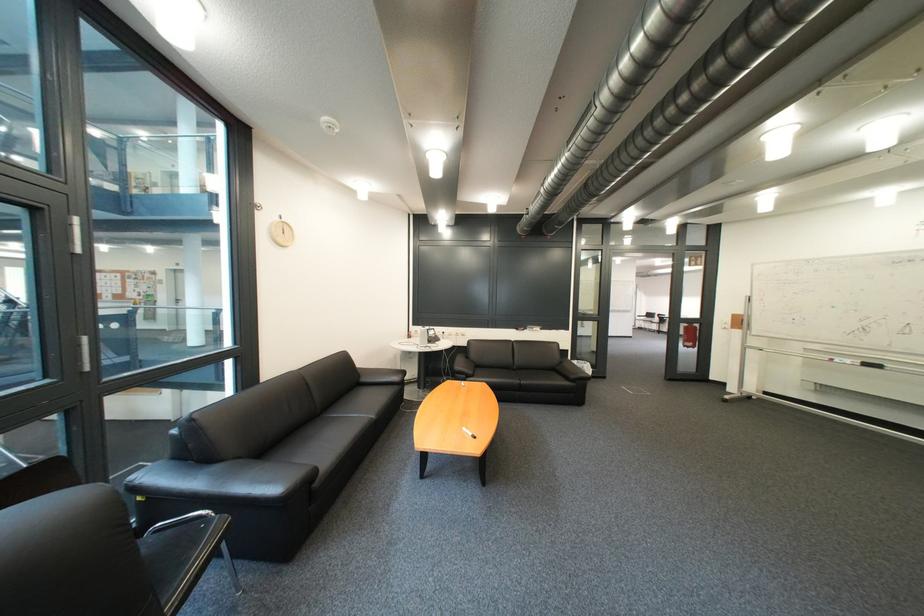
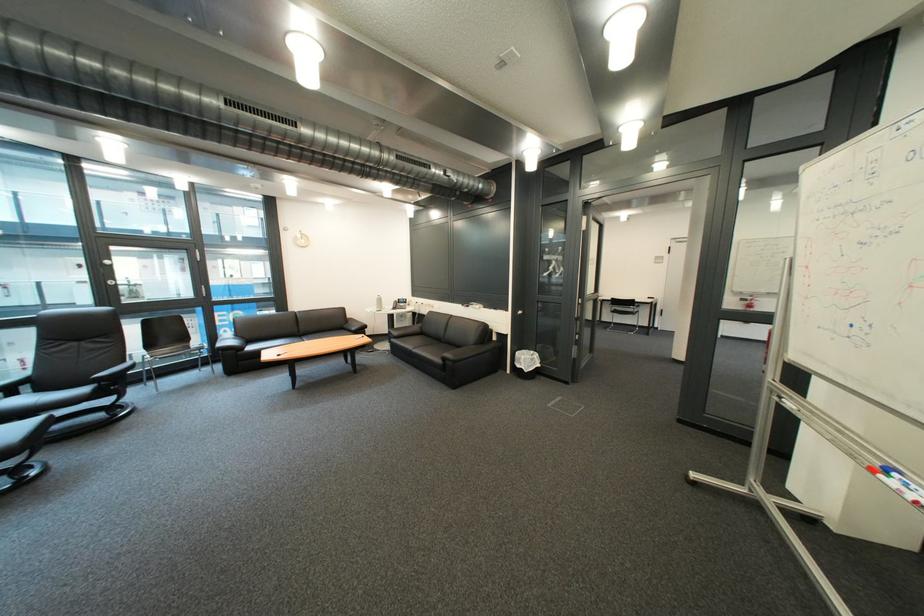
In the second image, find the point that corresponds to the point at 600,370 in the first image.

(536, 363)